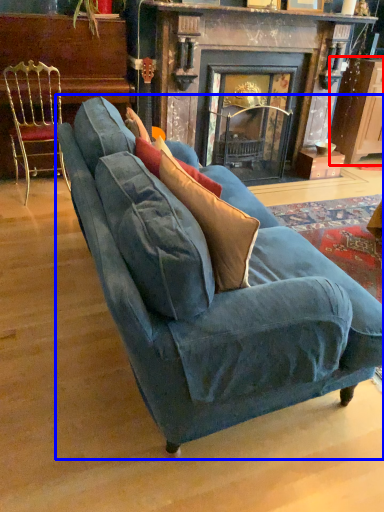
Question: Which of the following is the farthest to the observer, cabinetry (highlighted by a red box) or studio couch (highlighted by a blue box)?

Choices:
 (A) cabinetry
 (B) studio couch

Answer: (A)